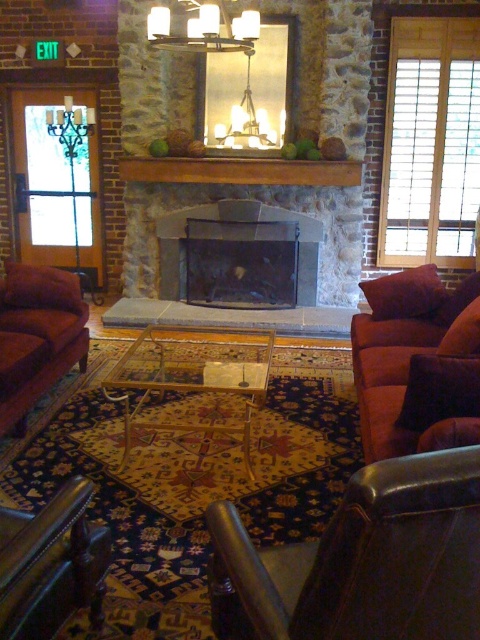
You are sitting on the velvet maroon couch at left and want to reach the dark gray stone fireplace at center. Which direction should you move to get closer to the fireplace?

Since the velvet maroon couch at left is below the dark gray stone fireplace at center, you should move upward towards the dark gray stone fireplace at center to get closer.

You are standing in the living room and want to move from the clear glass coffee table at center to the matte white fixture at upper center. Which direction should you move to reach the fixture?

You should move to the right to reach the matte white fixture at upper center because the clear glass coffee table at center is located to the left of the matte white fixture at upper center.

You are a guest entering the living room and want to sit down. You prefer seating that is lower to the ground. Which couch should you choose between the velvet brown couch at right and the velvet maroon couch at left?

The velvet brown couch at right has a lesser height compared to the velvet maroon couch at left, so you should choose the velvet brown couch at right.